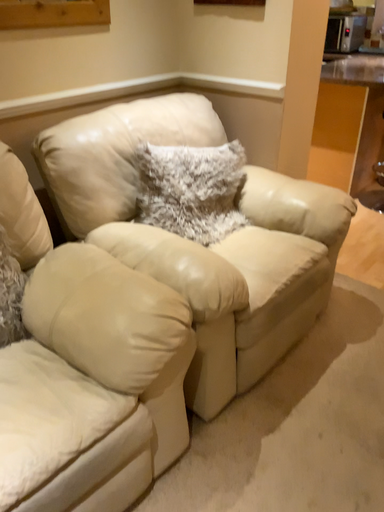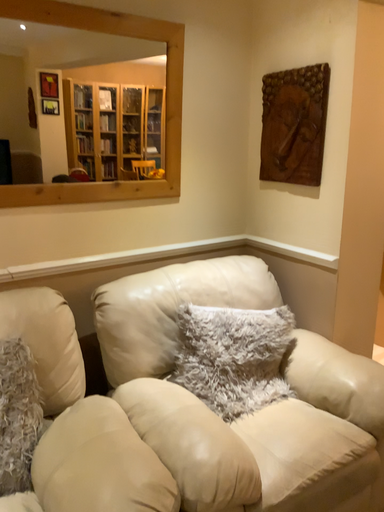
Question: Which way did the camera rotate in the video?

Choices:
 (A) rotated downward
 (B) rotated upward

Answer: (B)